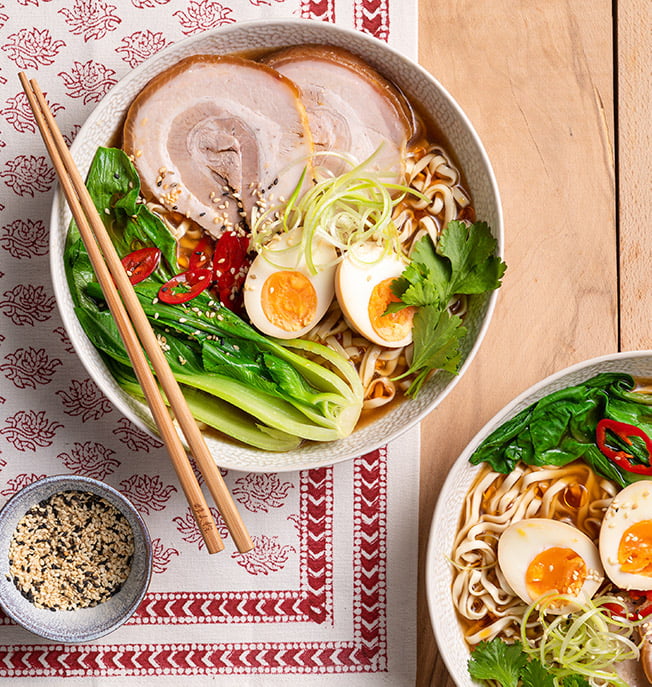
This screenshot has width=652, height=687. I want to click on crack in table, so click(615, 63).